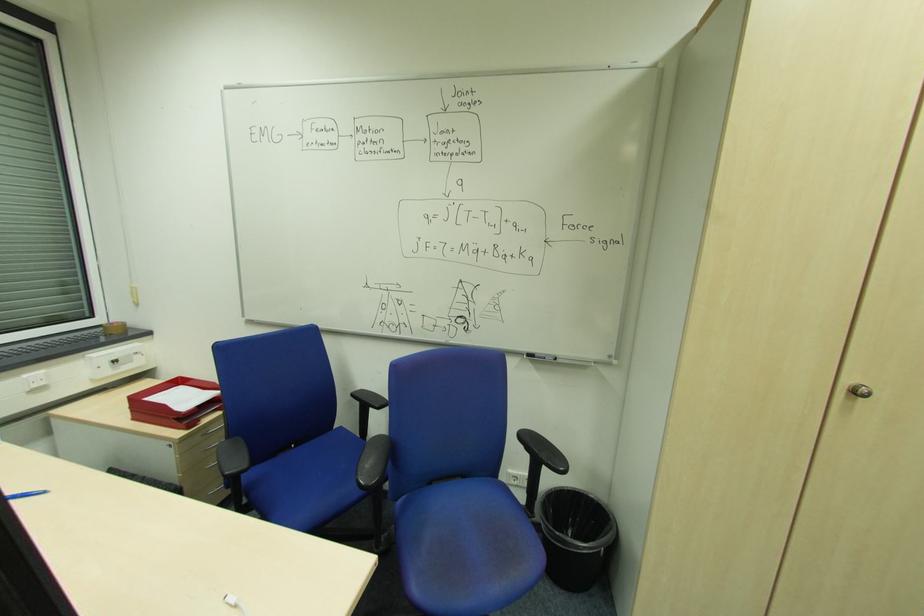
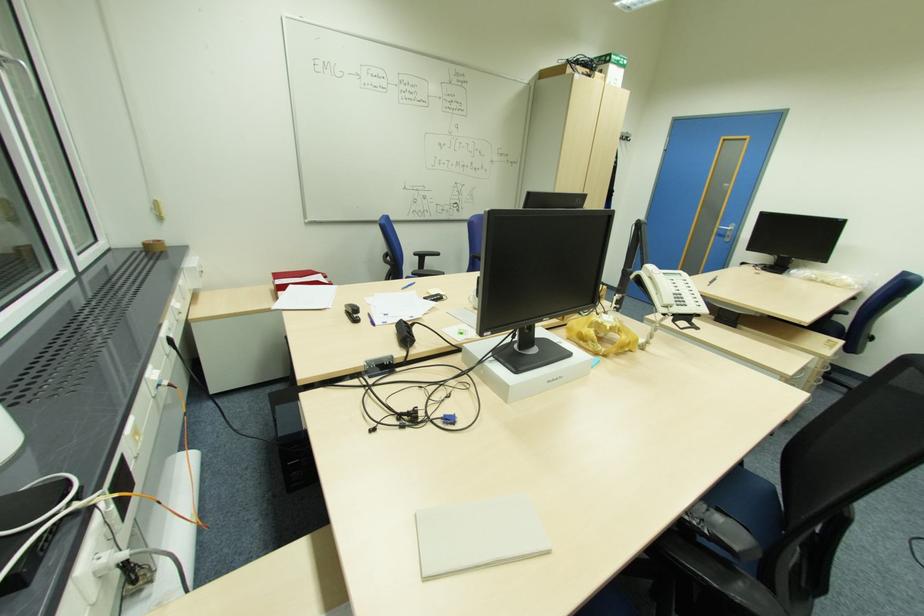
The point at (127, 323) is marked in the first image. Where is the corresponding point in the second image?

(162, 241)